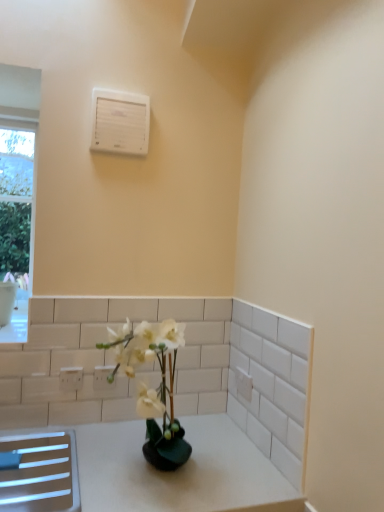
Question: Is point (71, 386) positioned closer to the camera than point (107, 389)?

Choices:
 (A) closer
 (B) farther

Answer: (A)

Question: Looking at their shapes, would you say white plastic electric outlet at lower left, which ranks as the 1th electric outlet in left-to-right order, is wider or thinner than white plastic electric outlet at lower left, the second electric outlet in the left-to-right sequence?

Choices:
 (A) thin
 (B) wide

Answer: (A)

Question: Which object is the closest to the white plastic air conditioning unit at upper center?

Choices:
 (A) white glossy vase at center
 (B) white plastic electric outlet at lower left, the second electric outlet in the left-to-right sequence
 (C) white plastic electric outlet at lower left, the second electric outlet in the right-to-left sequence

Answer: (A)

Question: Which of these objects is positioned closest to the white plastic electric outlet at lower left, the second electric outlet in the right-to-left sequence?

Choices:
 (A) white plastic electric outlet at lower left, the second electric outlet in the front-to-back sequence
 (B) white plastic air conditioning unit at upper center
 (C) white glossy vase at center

Answer: (A)